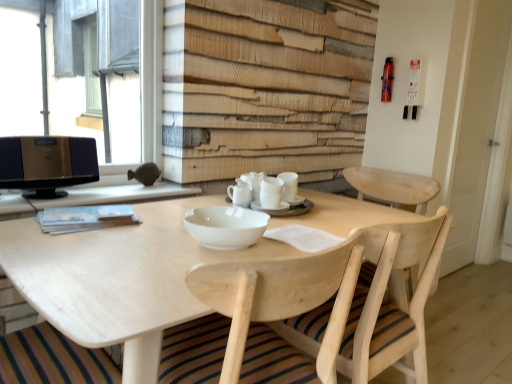
Where is `white matte paper at left`? This screenshot has height=384, width=512. white matte paper at left is located at coordinates (92, 197).

Image resolution: width=512 pixels, height=384 pixels. Describe the element at coordinates (47, 164) in the screenshot. I see `satin silver speaker at upper left` at that location.

Find the location of a particular element. This screenshot has height=384, width=512. natural wood table at center is located at coordinates (28, 269).

Identify the location of white ceramic cups at center, placed as the 2th tableware when sorted from right to left. (286, 209).

Is white matte cups at center, which ranks as the 1th tableware in left-to-right order, further to camera compared to white wooden door at right?

No, it is not.

Which of these two, white matte cups at center, which ranks as the 1th tableware in left-to-right order, or white wooden door at right, is thinner?

With smaller width is white wooden door at right.

Does white matte cups at center, which ranks as the 1th tableware in left-to-right order, have a lesser height compared to white wooden door at right?

Indeed, white matte cups at center, which ranks as the 1th tableware in left-to-right order, has a lesser height compared to white wooden door at right.

From the image's perspective, does white matte cups at center, the third tableware from the right, appear lower than white wooden door at right?

Indeed, from the image's perspective, white matte cups at center, the third tableware from the right, is shown beneath white wooden door at right.

In terms of height, does light wood chair at center look taller or shorter compared to satin silver speaker at upper left?

Clearly, light wood chair at center is taller compared to satin silver speaker at upper left.

Find the location of `chair that appears on the right of satin silver speaker at upper left`. chair that appears on the right of satin silver speaker at upper left is located at coordinates (391, 300).

Is light wood chair at center completely or partially outside of satin silver speaker at upper left?

Yes.

How far apart are light wood chair at center and satin silver speaker at upper left?

A distance of 1.13 meters exists between light wood chair at center and satin silver speaker at upper left.

From a real-world perspective, is natural wood table at center positioned above or below white matte paper at left?

natural wood table at center is situated lower than white matte paper at left in the real world.

Is natural wood table at center smaller than white matte paper at left?

Actually, natural wood table at center might be larger than white matte paper at left.

Is natural wood table at center at the right side of white matte paper at left?

Indeed, natural wood table at center is positioned on the right side of white matte paper at left.

Between natural wood table at center and white matte paper at left, which one has larger width?

Wider between the two is natural wood table at center.

Between white matte paper at left and metallic gray window at upper left, which one is positioned behind?

metallic gray window at upper left is more distant.

From the image's perspective, who appears lower, white matte paper at left or metallic gray window at upper left?

white matte paper at left, from the image's perspective.

Considering the sizes of white matte paper at left and metallic gray window at upper left in the image, is white matte paper at left wider or thinner than metallic gray window at upper left?

white matte paper at left is wider than metallic gray window at upper left.

Which of these two, white matte paper at left or metallic gray window at upper left, stands shorter?

white matte paper at left.

Is white wooden door at right in front of or behind light wood chair at center in the image?

Clearly, white wooden door at right is behind light wood chair at center.

Locate an element on the screen. This screenshot has height=384, width=512. chair below the white wooden door at right (from a real-world perspective) is located at coordinates (391, 300).

Is white wooden door at right touching light wood chair at center?

No, white wooden door at right is not touching light wood chair at center.

How many degrees apart are the facing directions of satin silver speaker at upper left and white matte cups at center, which ranks as the 1th tableware in left-to-right order?

The angular difference between satin silver speaker at upper left and white matte cups at center, which ranks as the 1th tableware in left-to-right order, is 0.0563 degrees.

From a real-world perspective, which is physically below, satin silver speaker at upper left or white matte cups at center, the third tableware from the right?

white matte cups at center, the third tableware from the right.

From the image's perspective, does satin silver speaker at upper left appear lower than white matte cups at center, the third tableware from the right?

No.

Based on the photo, are satin silver speaker at upper left and white matte cups at center, the third tableware from the right, making contact?

No, satin silver speaker at upper left is not beside white matte cups at center, the third tableware from the right.

Is white matte cups at center, which ranks as the 1th tableware in left-to-right order, in front of or behind natural wood table at center in the image?

white matte cups at center, which ranks as the 1th tableware in left-to-right order, is behind natural wood table at center.

From the image's perspective, is white matte cups at center, which ranks as the 1th tableware in left-to-right order, located above or below natural wood table at center?

From the image's perspective, white matte cups at center, which ranks as the 1th tableware in left-to-right order, appears above natural wood table at center.

Does white matte cups at center, which ranks as the 1th tableware in left-to-right order, have a lesser width compared to natural wood table at center?

Correct, the width of white matte cups at center, which ranks as the 1th tableware in left-to-right order, is less than that of natural wood table at center.

Looking at this image, which object is positioned more to the right, white matte cups at center, which ranks as the 1th tableware in left-to-right order, or natural wood table at center?

natural wood table at center is more to the right.

The width and height of the screenshot is (512, 384). I want to click on screen door above the white matte cups at center, the third tableware from the right (from a real-world perspective), so click(x=474, y=126).

Identify the location of computer monitor above the light wood chair at center (from the image's perspective). The width and height of the screenshot is (512, 384). (47, 164).

Based on their spatial positions, is white matte cups at center, the third tableware from the right, or white ceramic cups at center, placed as the 2th tableware when sorted from right to left, further from white wooden door at right?

Among the two, white matte cups at center, the third tableware from the right, is located further to white wooden door at right.

Which object lies nearer to the anchor point light wood chair at center, white wooden door at right or white ceramic cups at center, placed as the 2th tableware when sorted from right to left?

white ceramic cups at center, placed as the 2th tableware when sorted from right to left, lies closer to light wood chair at center than the other object.

Based on their spatial positions, is white wooden door at right or white matte paper at left closer to white ceramic cups at center, placed as the 2th tableware when sorted from right to left?

white matte paper at left lies closer to white ceramic cups at center, placed as the 2th tableware when sorted from right to left, than the other object.

Considering their positions, is white matte cups at center, the third tableware from the right, positioned further to metallic gray window at upper left than satin silver speaker at upper left?

white matte cups at center, the third tableware from the right, is positioned further to the anchor metallic gray window at upper left.

When comparing their distances from white ceramic cups at center, which is the 2th tableware in left-to-right order, does light wood chair at center or white matte cups at center, arranged as the first tableware when viewed from the right, seem further?

light wood chair at center is positioned further to the anchor white ceramic cups at center, which is the 2th tableware in left-to-right order.

When comparing their distances from white wooden door at right, does white matte cups at center, arranged as the first tableware when viewed from the right, or white matte paper at left seem further?

white matte paper at left.

When comparing their distances from white matte cups at center, arranged as the first tableware when viewed from the right, does white matte paper at left or light wood chair at center seem further?

The object further to white matte cups at center, arranged as the first tableware when viewed from the right, is white matte paper at left.

Looking at the image, which one is located closer to white wooden door at right, natural wood table at center or white matte cups at center, arranged as the first tableware when viewed from the right?

white matte cups at center, arranged as the first tableware when viewed from the right, lies closer to white wooden door at right than the other object.

Where is `window between satin silver speaker at upper left and white matte cups at center, which ranks as the 1th tableware in left-to-right order`? window between satin silver speaker at upper left and white matte cups at center, which ranks as the 1th tableware in left-to-right order is located at coordinates (110, 81).

The height and width of the screenshot is (384, 512). What are the coordinates of `computer desk positioned between natural wood table at center and white matte cups at center, arranged as the first tableware when viewed from the right, from near to far` in the screenshot? It's located at (92, 197).

Find the location of a particular element. Image resolution: width=512 pixels, height=384 pixels. table situated between satin silver speaker at upper left and light wood chair at center from left to right is located at coordinates (28, 269).

Locate an element on the screen. computer desk situated between metallic gray window at upper left and white ceramic cups at center, placed as the 2th tableware when sorted from right to left, from left to right is located at coordinates (92, 197).